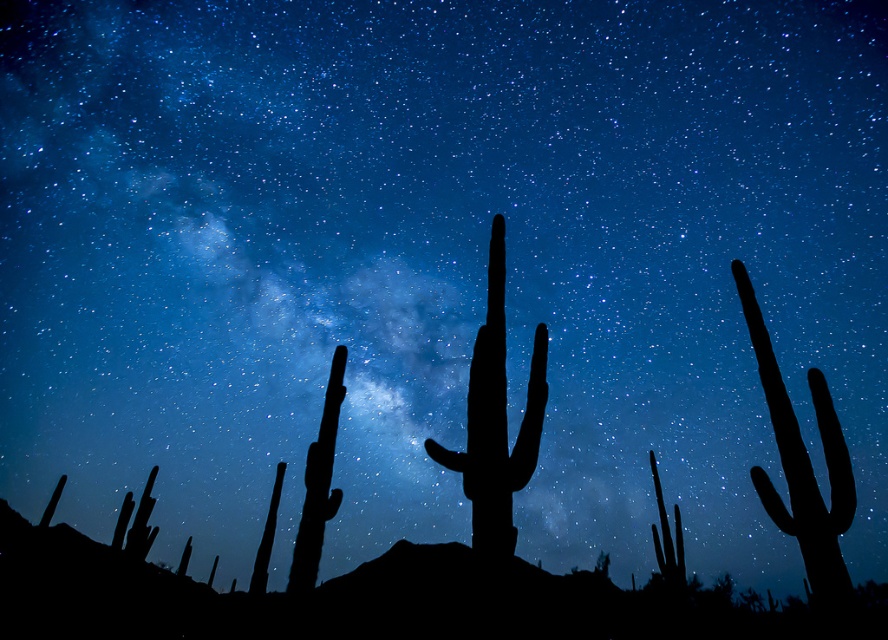
Does point (441, 465) lie in front of point (818, 372)?

Yes, it is in front of point (818, 372).

Between black matte cactus at center and silhouette cactus at right, which one appears on the left side from the viewer's perspective?

black matte cactus at center is more to the left.

Does point (490, 358) come in front of point (825, 545)?

No, it is not.

What are the coordinates of `black matte cactus at center` in the screenshot? It's located at (496, 419).